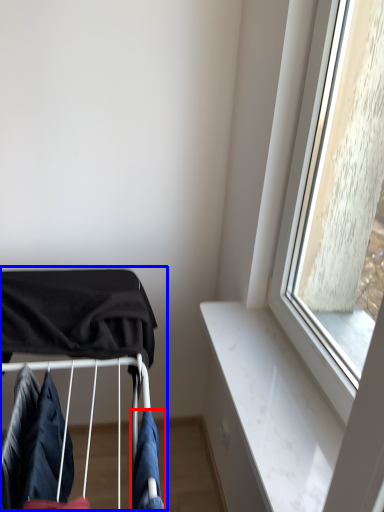
Question: Which of the following is the farthest to the observer, clothing (highlighted by a red box) or baby carriage (highlighted by a blue box)?

Choices:
 (A) clothing
 (B) baby carriage

Answer: (B)